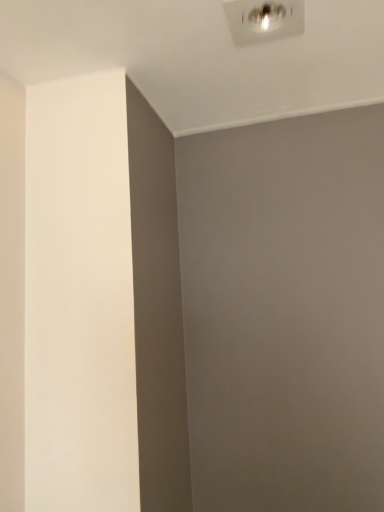
I want to click on white plastic light fixture at upper center, so click(x=263, y=20).

Describe the element at coordinates (263, 20) in the screenshot. The width and height of the screenshot is (384, 512). I see `white plastic light fixture at upper center` at that location.

Locate an element on the screen. This screenshot has width=384, height=512. white plastic light fixture at upper center is located at coordinates (263, 20).